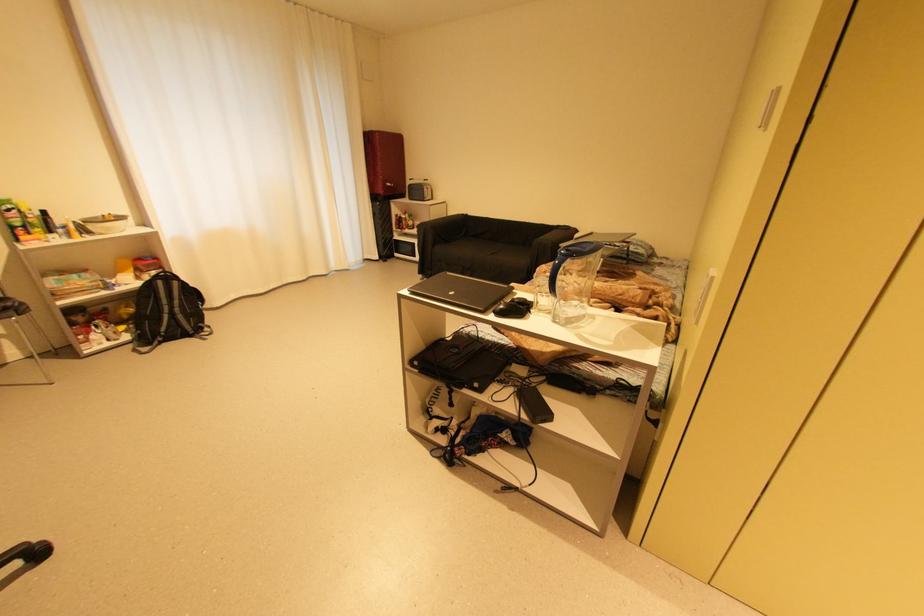
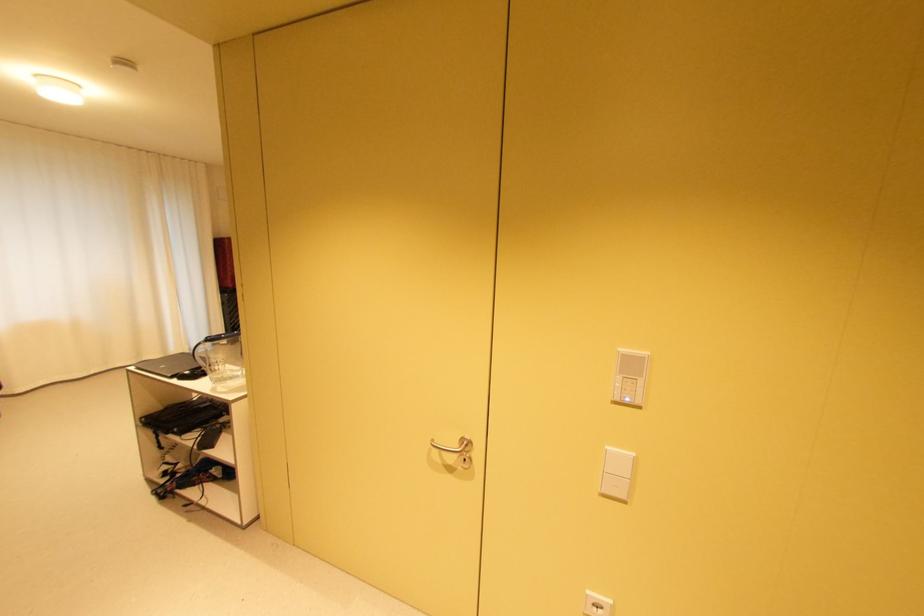
The point at (459, 293) is marked in the first image. Where is the corresponding point in the second image?

(171, 367)